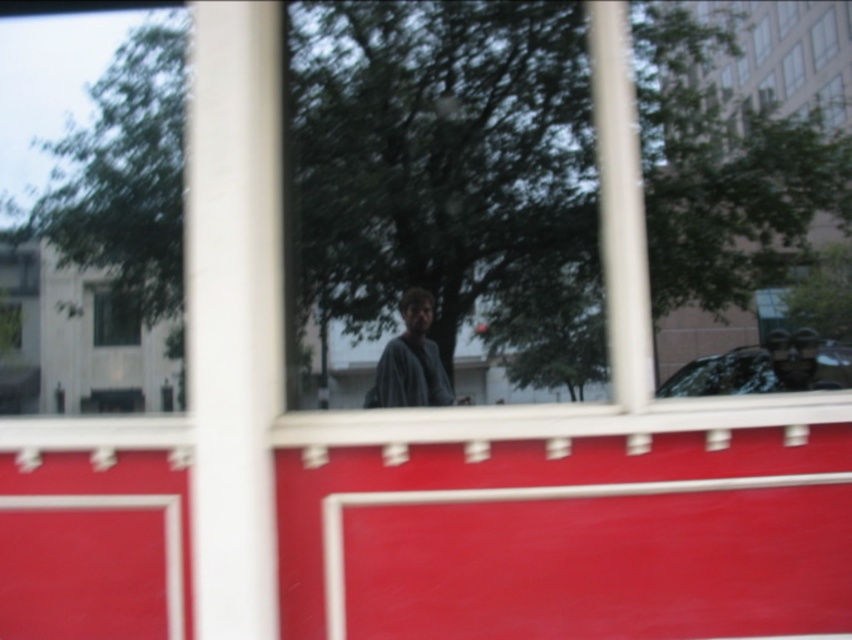
Which is behind, point (375, 403) or point (135, 316)?

The point (135, 316) is behind.

This screenshot has height=640, width=852. Identify the location of gray knit sweater at center. (410, 362).

In the scene shown: Between transparent glass window at upper left and transparent glass window at upper right, which one has more height?

Standing taller between the two is transparent glass window at upper left.

Does point (124, 321) lie in front of point (793, 45)?

No, it is not.

The width and height of the screenshot is (852, 640). Identify the location of transparent glass window at upper left. (114, 317).

Does gray knit sweater at center have a larger size compared to clear glass window at upper right?

Yes, gray knit sweater at center is bigger than clear glass window at upper right.

Can you confirm if gray knit sweater at center is taller than clear glass window at upper right?

Indeed, gray knit sweater at center has a greater height compared to clear glass window at upper right.

Is point (426, 317) less distant than point (816, 45)?

That is False.

Identify the location of gray knit sweater at center. (410, 362).